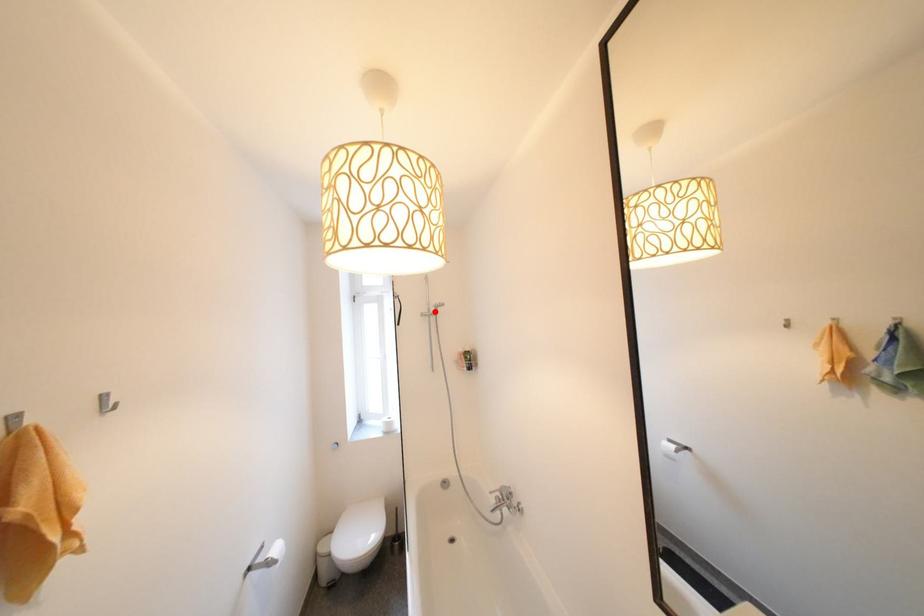
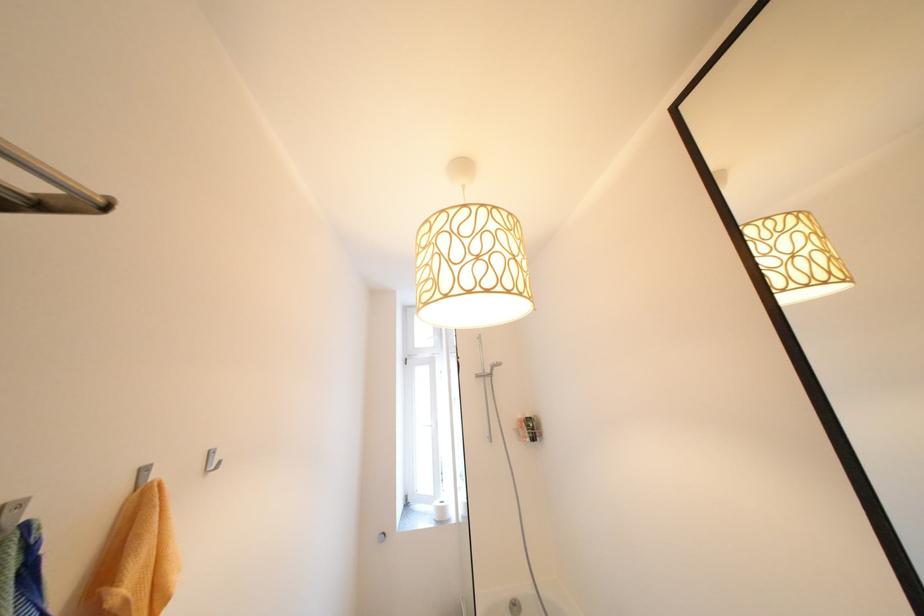
Question: I am providing you with two images of the same scene from different viewpoints. A red point is marked on the first image. Can you still see the location of the red point in image 2?

Choices:
 (A) Yes
 (B) No

Answer: (A)